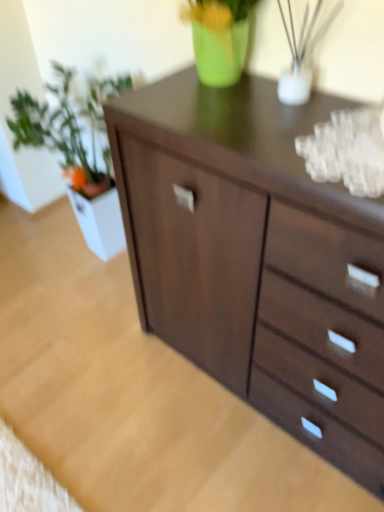
What is the approximate width of green matte plant at left?

green matte plant at left is 19.62 inches wide.

Find the location of `green matte plant at left`. green matte plant at left is located at coordinates (76, 152).

What do you see at coordinates (76, 152) in the screenshot?
I see `green matte plant at left` at bounding box center [76, 152].

From the picture: What is the approximate width of dark wood chest of drawers at center?

It is 1.10 meters.

This screenshot has width=384, height=512. I want to click on dark wood chest of drawers at center, so click(x=256, y=258).

What is the approximate height of dark wood chest of drawers at center?

dark wood chest of drawers at center is 2.38 inches in height.

Describe the element at coordinates (256, 258) in the screenshot. The width and height of the screenshot is (384, 512). I see `dark wood chest of drawers at center` at that location.

Locate an element on the screen. Image resolution: width=384 pixels, height=512 pixels. green matte plant at left is located at coordinates click(76, 152).

Which is more to the right, green matte plant at left or dark wood chest of drawers at center?

dark wood chest of drawers at center.

Is green matte plant at left closer to camera compared to dark wood chest of drawers at center?

No, green matte plant at left is further to the viewer.

Which is behind, point (65, 144) or point (252, 142)?

The point (65, 144) is behind.

From the image's perspective, who appears lower, green matte plant at left or dark wood chest of drawers at center?

dark wood chest of drawers at center.

From a real-world perspective, is green matte plant at left physically located above or below dark wood chest of drawers at center?

From a real-world perspective, green matte plant at left is physically above dark wood chest of drawers at center.

Considering the sizes of green matte plant at left and dark wood chest of drawers at center in the image, is green matte plant at left wider or thinner than dark wood chest of drawers at center?

In the image, green matte plant at left appears to be more narrow than dark wood chest of drawers at center.

In terms of height, does green matte plant at left look taller or shorter compared to dark wood chest of drawers at center?

green matte plant at left is taller than dark wood chest of drawers at center.

Considering the sizes of objects green matte plant at left and dark wood chest of drawers at center in the image provided, who is smaller, green matte plant at left or dark wood chest of drawers at center?

dark wood chest of drawers at center is smaller.

Is dark wood chest of drawers at center completely or partially inside green matte plant at left?

Actually, dark wood chest of drawers at center is outside green matte plant at left.

Would you say green matte plant at left is a long distance from dark wood chest of drawers at center?

That's not correct — green matte plant at left is a little close to dark wood chest of drawers at center.

Could you tell me if green matte plant at left is facing dark wood chest of drawers at center?

No.

How many degrees apart are the facing directions of green matte plant at left and dark wood chest of drawers at center?

The facing directions of green matte plant at left and dark wood chest of drawers at center are 180 degrees apart.

Locate an element on the screen. The width and height of the screenshot is (384, 512). chest of drawers below the green matte plant at left (from a real-world perspective) is located at coordinates (256, 258).

Does dark wood chest of drawers at center appear on the left side of green matte plant at left?

No, dark wood chest of drawers at center is not to the left of green matte plant at left.

Which is in front, dark wood chest of drawers at center or green matte plant at left?

dark wood chest of drawers at center is in front.

Which is further, (143, 252) or (112, 186)?

The point (112, 186) is more distant.

From the image's perspective, which object appears higher, dark wood chest of drawers at center or green matte plant at left?

green matte plant at left, from the image's perspective.

From a real-world perspective, is dark wood chest of drawers at center physically located above or below green matte plant at left?

From a real-world perspective, dark wood chest of drawers at center is physically below green matte plant at left.

Which object is thinner, dark wood chest of drawers at center or green matte plant at left?

With smaller width is green matte plant at left.

Who is taller, dark wood chest of drawers at center or green matte plant at left?

Standing taller between the two is green matte plant at left.

Can you confirm if dark wood chest of drawers at center is bigger than green matte plant at left?

No, dark wood chest of drawers at center is not bigger than green matte plant at left.

Is dark wood chest of drawers at center situated inside green matte plant at left or outside?

dark wood chest of drawers at center is located beyond the bounds of green matte plant at left.

Is dark wood chest of drawers at center far from green matte plant at left?

Actually, dark wood chest of drawers at center and green matte plant at left are a little close together.

Is dark wood chest of drawers at center facing towards green matte plant at left?

No.

What's the angular difference between dark wood chest of drawers at center and green matte plant at left's facing directions?

They differ by 180 degrees in their facing directions.

Where is `houseplant behind the dark wood chest of drawers at center`? This screenshot has width=384, height=512. houseplant behind the dark wood chest of drawers at center is located at coordinates (76, 152).

I want to click on chest of drawers that is on the right side of green matte plant at left, so click(x=256, y=258).

At what (x,y) coordinates should I click in order to perform the action: click on houseplant above the dark wood chest of drawers at center (from the image's perspective). Please return your answer as a coordinate pair (x, y). This screenshot has width=384, height=512. Looking at the image, I should click on (76, 152).